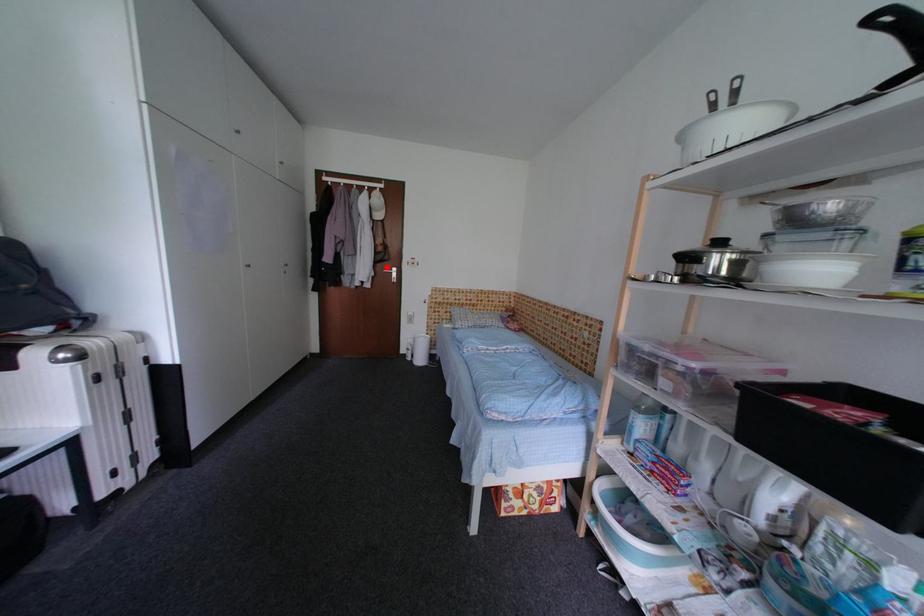
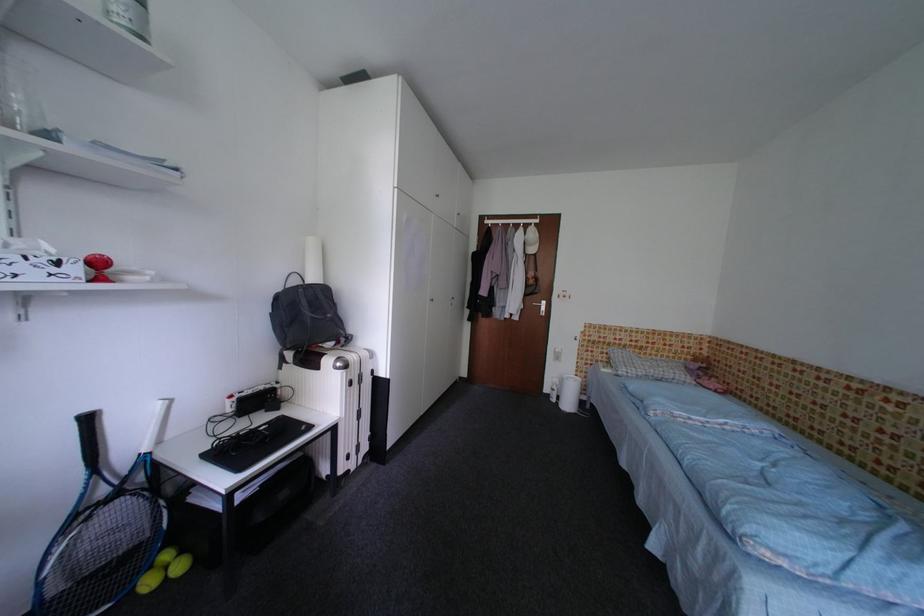
Find the pixel in the second image that matches the highlighted location in the first image.

(536, 300)